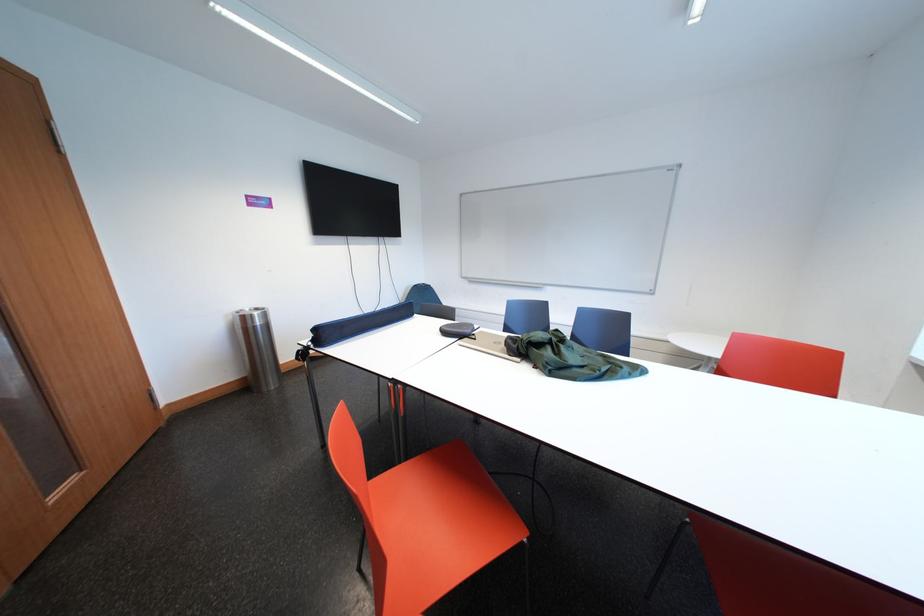
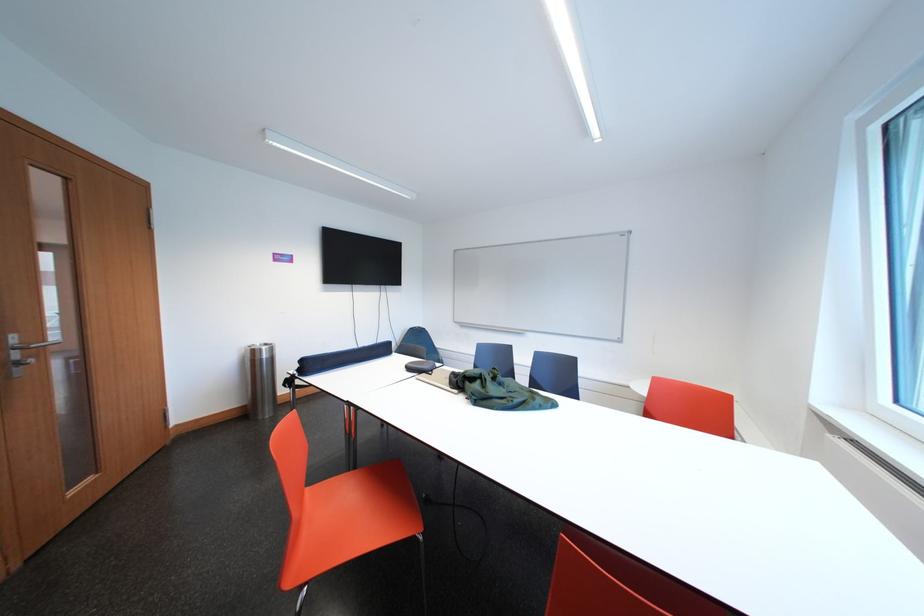
The point at (254,323) is marked in the first image. Where is the corresponding point in the second image?

(263, 357)